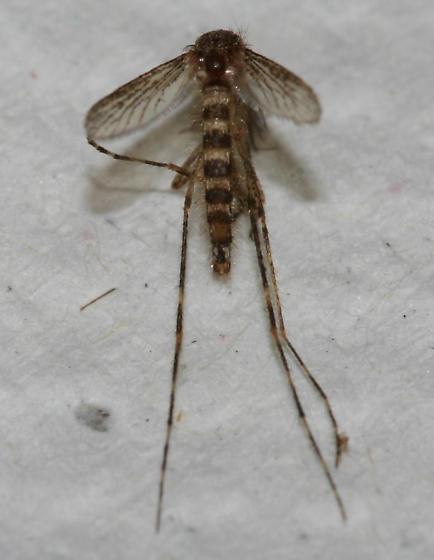
This screenshot has height=560, width=434. Identify the location of white surface. (386, 298).